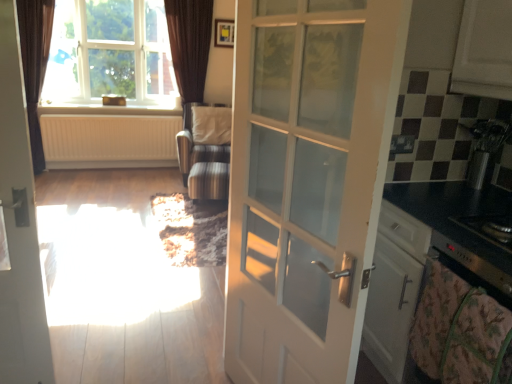
Question: Is brown velvet curtain at upper left bigger than clear glass window at upper left?

Choices:
 (A) yes
 (B) no

Answer: (B)

Question: From the image's perspective, is brown velvet curtain at upper left located above clear glass window at upper left?

Choices:
 (A) yes
 (B) no

Answer: (B)

Question: Considering the relative sizes of brown velvet curtain at upper left and clear glass window at upper left in the image provided, is brown velvet curtain at upper left smaller than clear glass window at upper left?

Choices:
 (A) no
 (B) yes

Answer: (B)

Question: Can you confirm if brown velvet curtain at upper left is positioned to the right of clear glass window at upper left?

Choices:
 (A) no
 (B) yes

Answer: (A)

Question: From the image's perspective, is brown velvet curtain at upper left under clear glass window at upper left?

Choices:
 (A) yes
 (B) no

Answer: (A)

Question: Is brown velvet curtain at upper left wider or thinner than striped fabric armchair at center?

Choices:
 (A) wide
 (B) thin

Answer: (B)

Question: From the image's perspective, relative to striped fabric armchair at center, is brown velvet curtain at upper left above or below?

Choices:
 (A) below
 (B) above

Answer: (B)

Question: Is brown velvet curtain at upper left in front of or behind striped fabric armchair at center in the image?

Choices:
 (A) behind
 (B) front

Answer: (B)

Question: Visually, is brown velvet curtain at upper left positioned to the left or to the right of striped fabric armchair at center?

Choices:
 (A) right
 (B) left

Answer: (B)

Question: Do you think white matte cabinet at upper right is within clear glass window at upper left, or outside of it?

Choices:
 (A) outside
 (B) inside

Answer: (A)

Question: In terms of height, does white matte cabinet at upper right look taller or shorter compared to clear glass window at upper left?

Choices:
 (A) short
 (B) tall

Answer: (A)

Question: From a real-world perspective, is white matte cabinet at upper right positioned above or below clear glass window at upper left?

Choices:
 (A) above
 (B) below

Answer: (A)

Question: Considering their positions, is white matte cabinet at upper right located in front of or behind clear glass window at upper left?

Choices:
 (A) behind
 (B) front

Answer: (B)

Question: From the image's perspective, is black glass stove at right, the first appliance in the bottom-to-top sequence, above or below metallic stainless steel kettle at right, acting as the first appliance starting from the top?

Choices:
 (A) above
 (B) below

Answer: (B)

Question: Considering their positions, is black glass stove at right, the first appliance in the bottom-to-top sequence, located in front of or behind metallic stainless steel kettle at right, which appears as the second appliance when ordered from the bottom?

Choices:
 (A) front
 (B) behind

Answer: (A)